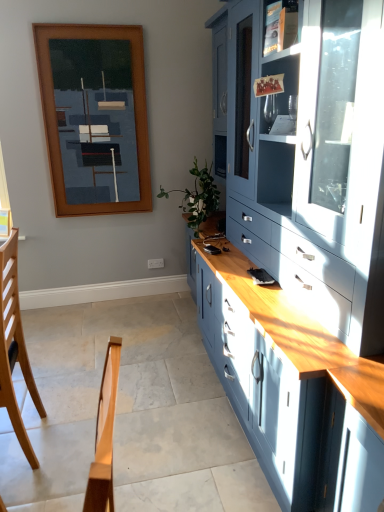
Question: Is green leafy plant at center taller or shorter than matte blue cabinet at right?

Choices:
 (A) short
 (B) tall

Answer: (A)

Question: Is green leafy plant at center inside the boundaries of matte blue cabinet at right, or outside?

Choices:
 (A) outside
 (B) inside

Answer: (B)

Question: Which is nearer to the matte blue cabinet at right?

Choices:
 (A) light brown wood chair at lower left
 (B) wooden picture frame at upper left
 (C) green leafy plant at center
 (D) matte glass shelf at upper right

Answer: (D)

Question: Estimate the real-world distances between objects in this image. Which object is farther from the matte glass shelf at upper right?

Choices:
 (A) green leafy plant at center
 (B) light brown wood chair at lower left
 (C) matte blue cabinet at right
 (D) wooden picture frame at upper left

Answer: (D)